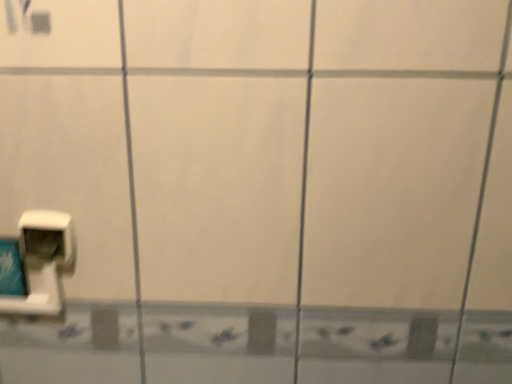
At what (x,y) coordinates should I click in order to perform the action: click on teal glossy phone at lower left. Please return your answer as a coordinate pair (x, y). The image size is (512, 384). Looking at the image, I should click on (11, 269).

This screenshot has height=384, width=512. What do you see at coordinates (11, 269) in the screenshot?
I see `teal glossy phone at lower left` at bounding box center [11, 269].

The height and width of the screenshot is (384, 512). In order to click on teal glossy phone at lower left in this screenshot , I will do `click(11, 269)`.